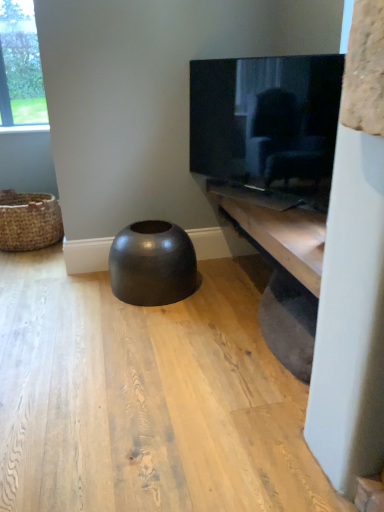
Where is `unoccupied region to the right of glossy black stool at center`? unoccupied region to the right of glossy black stool at center is located at coordinates (225, 274).